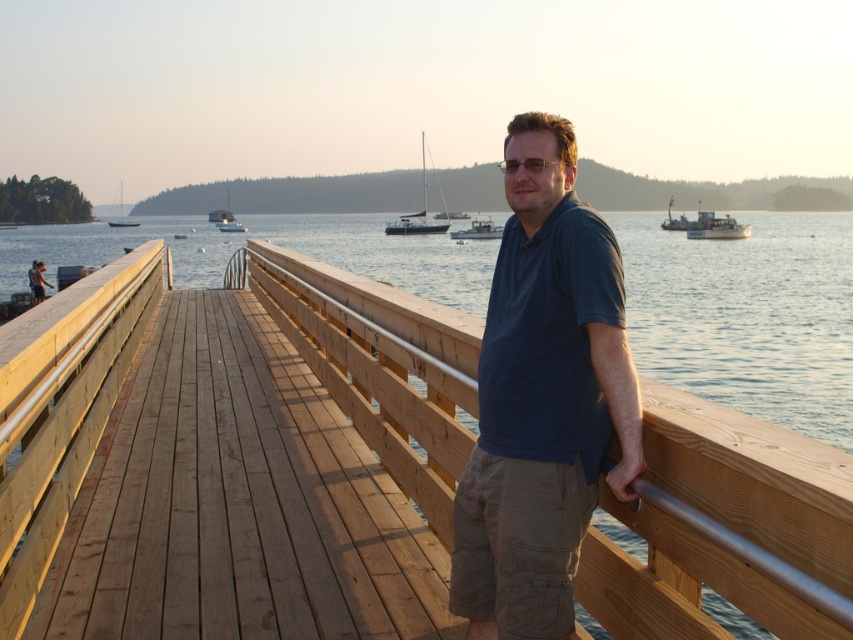
You are standing on the wooden pier and want to place a small item on the dark blue shirt at center so that it stays there. Where should you place it relative to the white plastic boat at right?

The dark blue shirt at center is located below the white plastic boat at right, so placing the item on the dark blue shirt at center would position it directly underneath the white plastic boat at right.

You are a photographer trying to capture a photo of the dark blue shirt at center and the white glossy sailboat at center. Based on their positions, which object should you focus on first if you want to include both in your shot without moving the camera?

The dark blue shirt at center is positioned on the right side of the white glossy sailboat at center, so you should focus on the white glossy sailboat at center first to ensure both are in frame.

You are a photographer trying to capture both the dark blue shirt at center and the white plastic boat at right in the same frame. Based on their sizes in the image, which object should you focus on first to ensure both are in focus?

The dark blue shirt at center is not as tall as the white plastic boat at right, so you should focus on the white plastic boat at right first since it is larger and will require more precise focusing to ensure both are in focus.